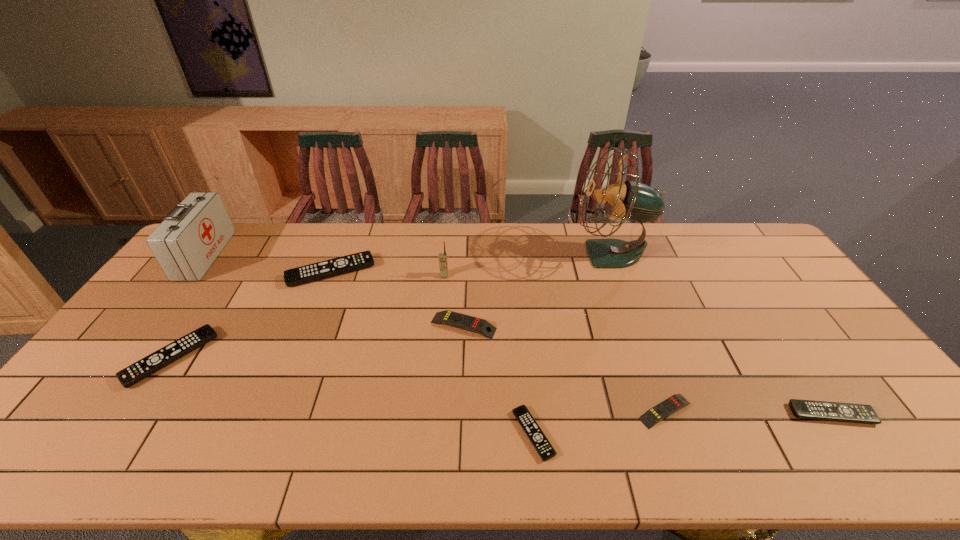
In order to click on remote control located at the far edge in this screenshot , I will do `click(356, 261)`.

This screenshot has width=960, height=540. I want to click on object situated at the near edge, so click(540, 442).

This screenshot has width=960, height=540. I want to click on the first-aid kit that is at the left edge, so (190, 238).

This screenshot has height=540, width=960. Identify the location of remote control at the left edge. (159, 359).

At what (x,y) coordinates should I click in order to perform the action: click on object located in the right edge section of the desktop. Please return your answer as a coordinate pair (x, y). The image size is (960, 540). Looking at the image, I should click on (806, 409).

Identify the location of object that is at the far left corner. The image size is (960, 540). (190, 238).

The image size is (960, 540). What are the coordinates of `vacant space at the far edge of the desktop` in the screenshot? It's located at pyautogui.click(x=699, y=226).

This screenshot has width=960, height=540. I want to click on free space at the right edge of the desktop, so click(x=828, y=323).

In the image, there is a desktop. What are the coordinates of `vacant space at the near left corner` in the screenshot? It's located at (44, 446).

Locate an element on the screen. The height and width of the screenshot is (540, 960). free area in between the fourth remote control from right to left and the second biggest black remote control is located at coordinates (318, 341).